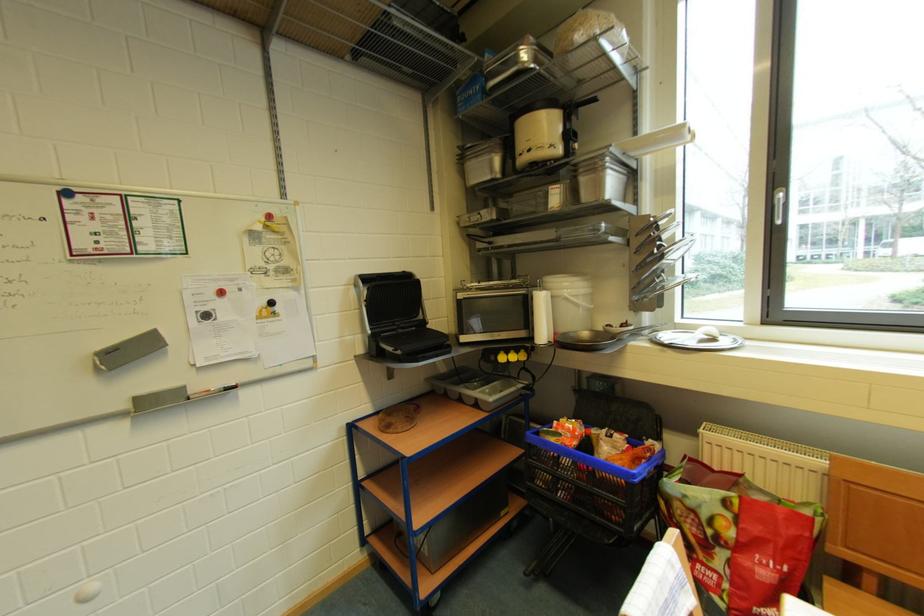
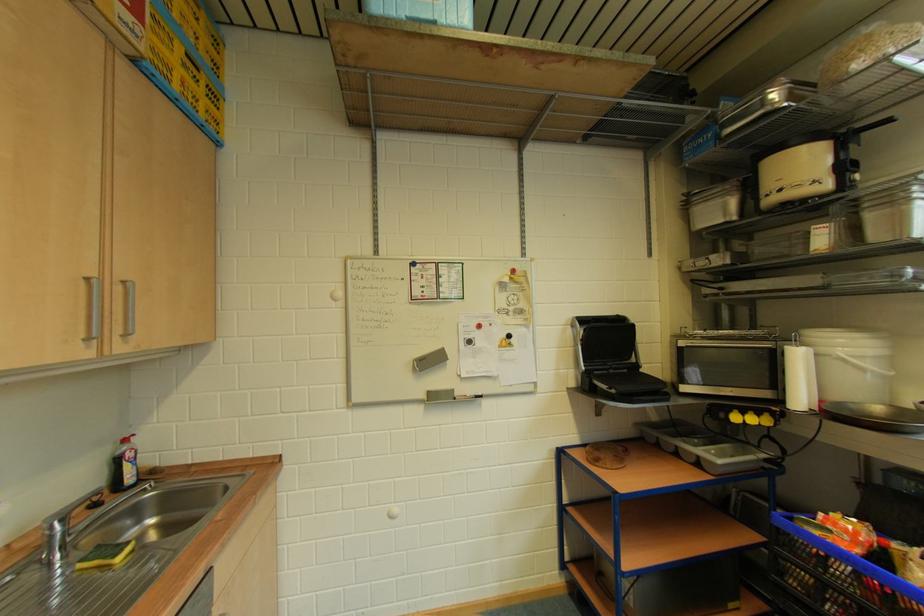
Where in the second image is the point corresponding to (592,338) from the first image?

(884, 411)